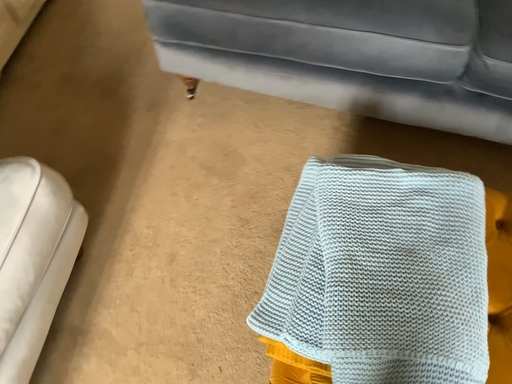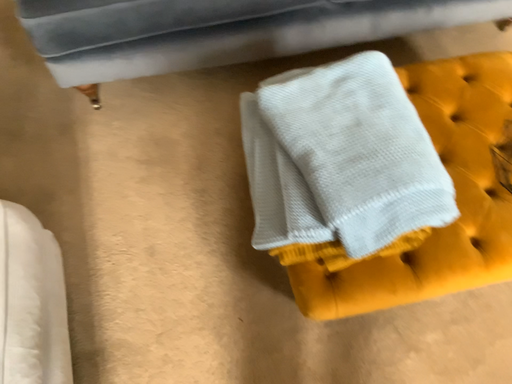
Question: Which way did the camera rotate in the video?

Choices:
 (A) rotated left
 (B) rotated right

Answer: (B)